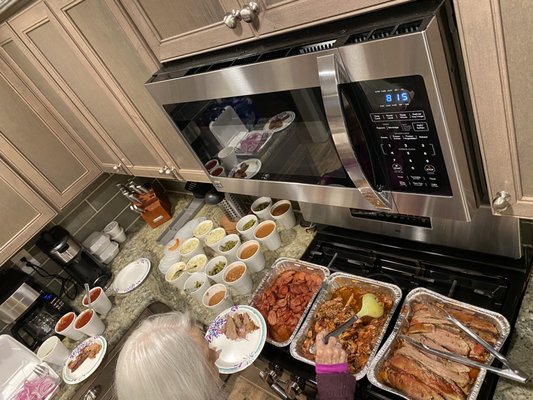
Locate an element on the screen. This screenshot has width=533, height=400. paper plate is located at coordinates (232, 348), (134, 273).